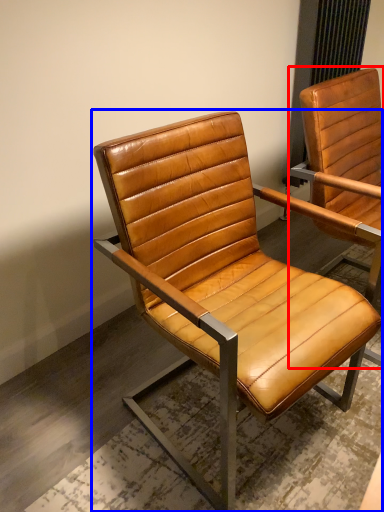
Question: Which object appears farthest to the camera in this image, chair (highlighted by a red box) or chair (highlighted by a blue box)?

Choices:
 (A) chair
 (B) chair

Answer: (A)